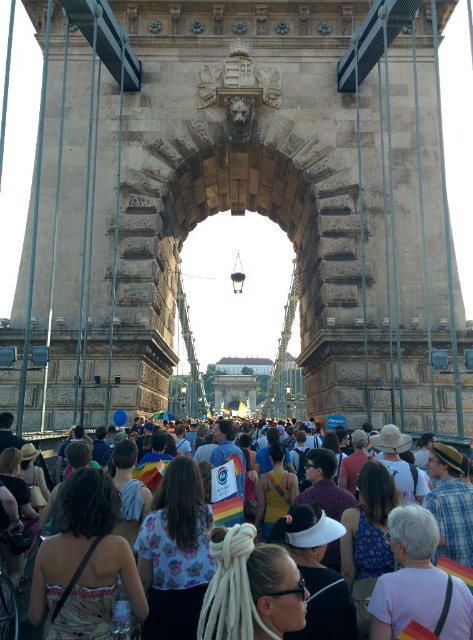
You are standing on the Chain Bridge in Budapest and want to take a photo of two specific points marked in the scene. The first point is at coordinates point (192, 492) and the second point is at point (332, 588). Since you want both points to be in focus, which point should you focus on to ensure the other is also sharp?

You should focus on point (332, 588) because it is farther from the camera than point (192, 492). By focusing on the farther point, the near point will also be within the depth of field.